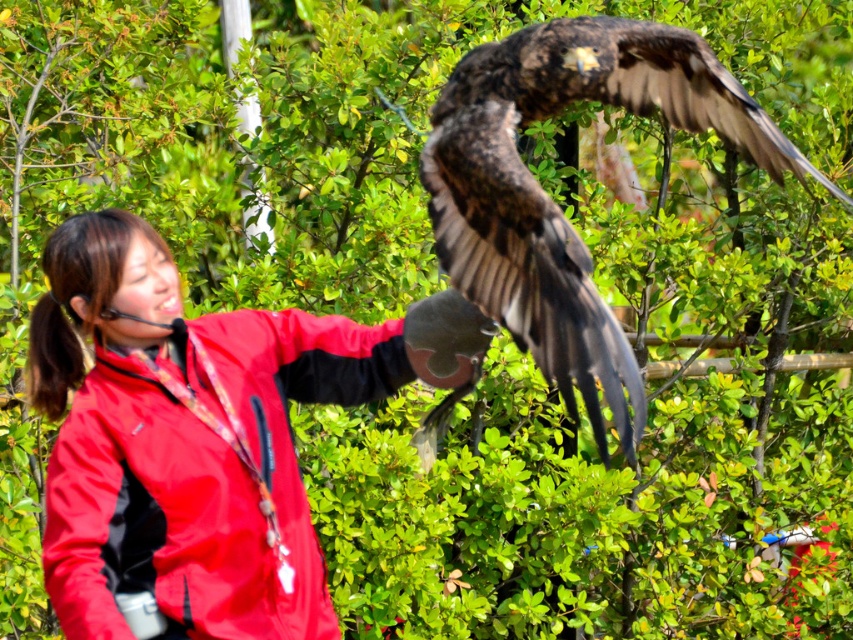
You are a photographer trying to capture a clear photo of the matte red jacket at center and the dark brown feathers at upper center. Which object should you focus on first to ensure both are in frame without moving the camera?

The matte red jacket at center has a lesser height compared to dark brown feathers at upper center, so you should focus on the dark brown feathers at upper center first to ensure both are in frame without moving the camera.

You are a photographer standing at a safe distance from the falconry demonstration. You want to capture a photo that includes both the matte red jacket at center and the dark brown feathers at upper center. Given that your camera has a maximum focus range of 50 centimeters, will you be able to get both objects in focus?

The matte red jacket at center is 47.44 centimeters from dark brown feathers at upper center. Since the distance between them is within the camera maximum focus range of 50 centimeters, you can capture both objects in focus.